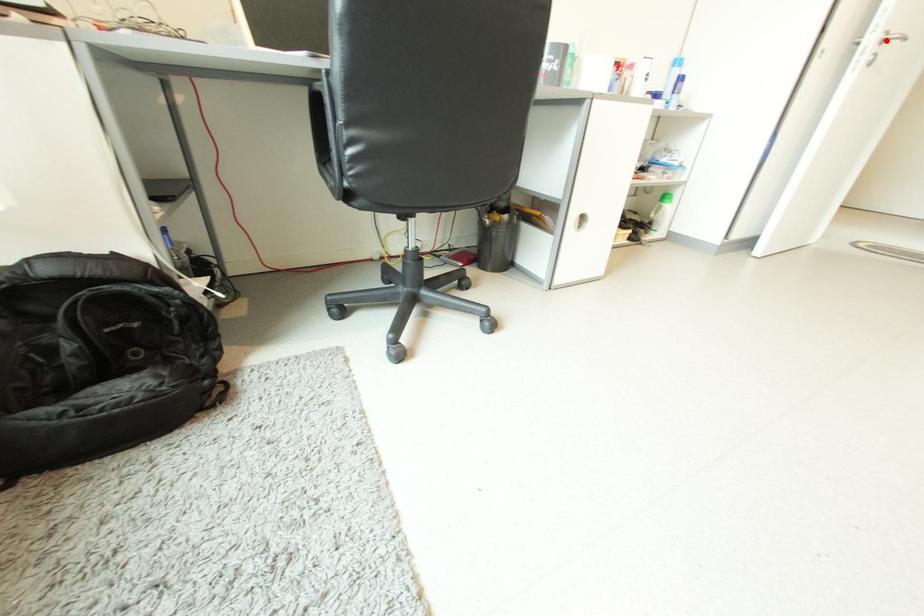
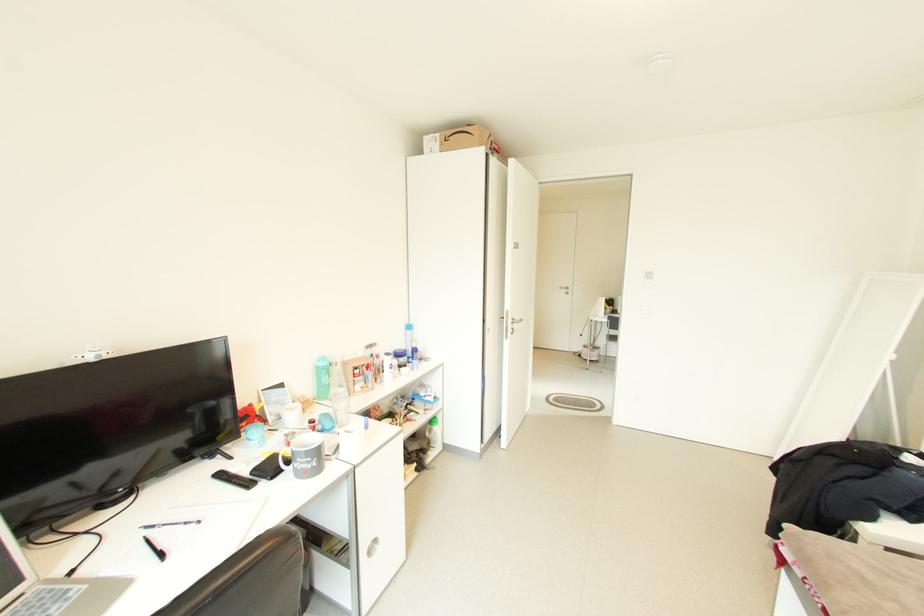
Find the pixel in the second image that matches the highlighted location in the first image.

(518, 323)